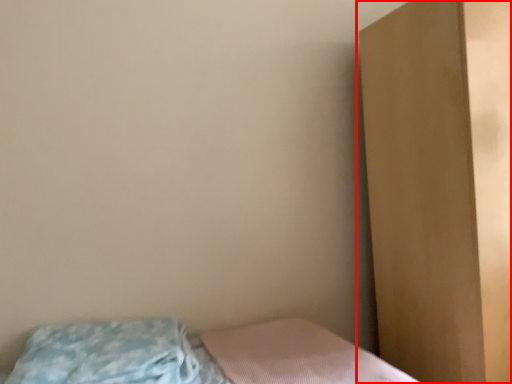
Question: Considering the relative positions of dresser (annotated by the red box) and pillow in the image provided, where is dresser (annotated by the red box) located with respect to the staircase?

Choices:
 (A) right
 (B) left

Answer: (A)